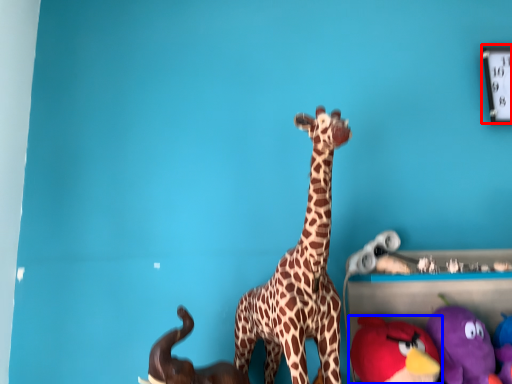
Question: Which point is further to the camera, clock (highlighted by a red box) or toy (highlighted by a blue box)?

Choices:
 (A) clock
 (B) toy

Answer: (A)